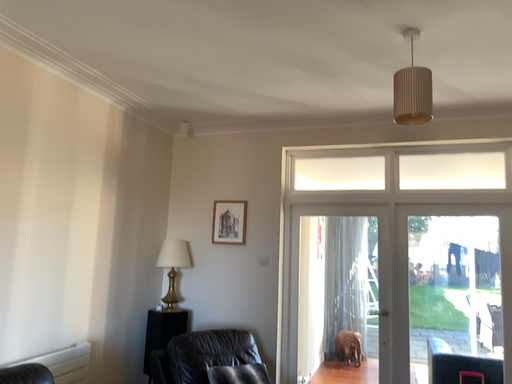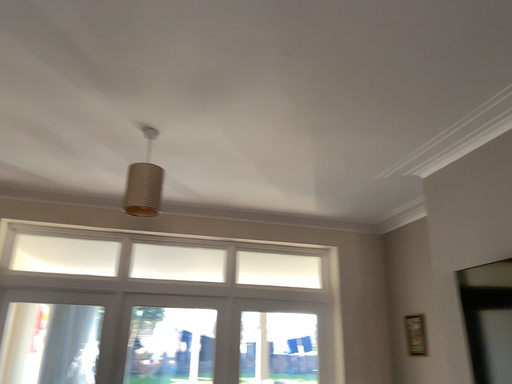
Question: Which way did the camera rotate in the video?

Choices:
 (A) rotated left
 (B) rotated right

Answer: (B)